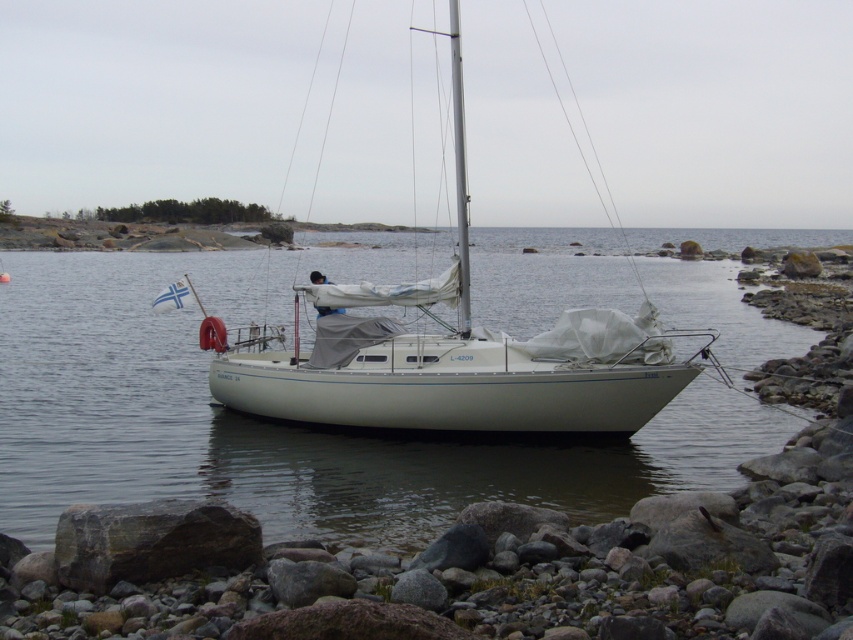
You are a photographer planning to capture the white water at center and the white matte sailboat at center in a single frame. Since both are white, how can you distinguish them in your photo?

The white water at center is positioned on the left side of white matte sailboat at center, so you can distinguish them by their relative positions in the frame.

You are standing on the rocky shoreline observing the scene. Which object is closer to you between the white water at center and the white matte sailboat at center?

The white water at center is closer to you than the white matte sailboat at center.